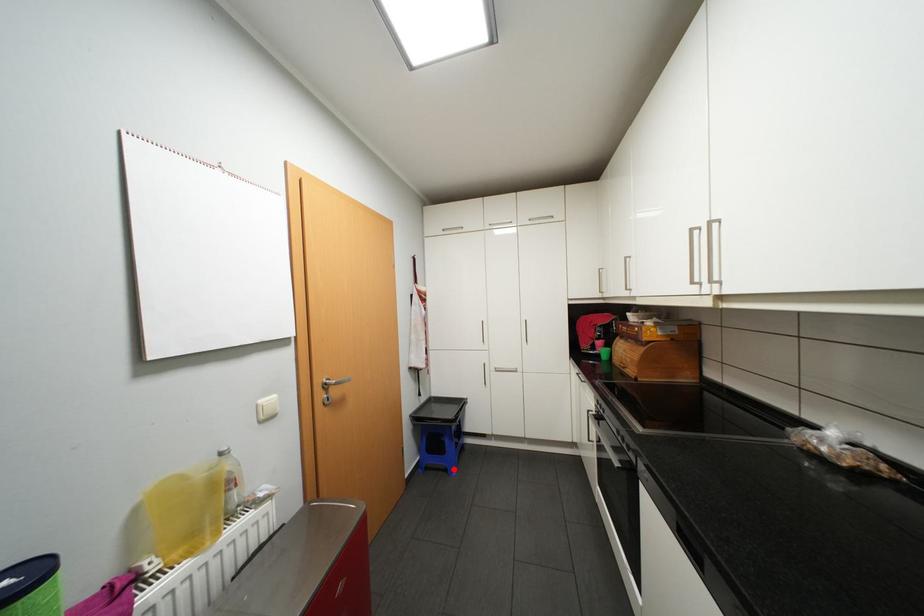
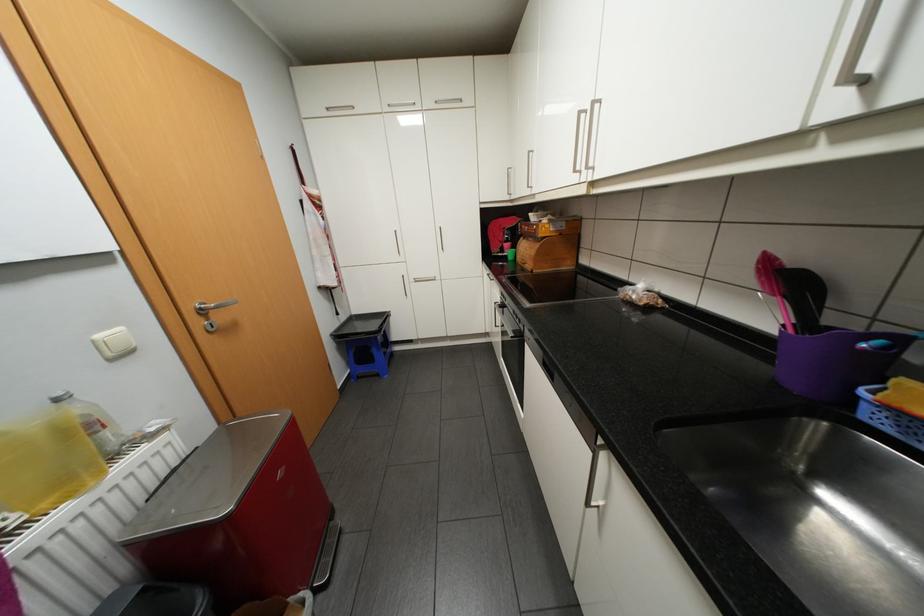
Question: I am providing you with two images of the same scene from different viewpoints. A red point is marked on the first image. Can you still see the location of the red point in image 2?

Choices:
 (A) Yes
 (B) No

Answer: (A)